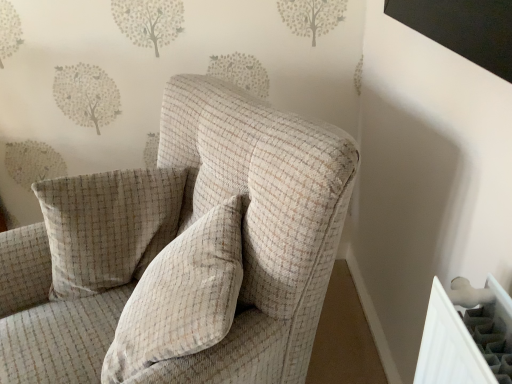
Question: Is beige checkered pillow at center, the second pillow from the front, taller than beige checkered pillow at center, the second pillow when ordered from back to front?

Choices:
 (A) no
 (B) yes

Answer: (B)

Question: Does beige checkered pillow at center, the second pillow from the front, have a greater width compared to beige checkered pillow at center, the 1th pillow positioned from the front?

Choices:
 (A) yes
 (B) no

Answer: (B)

Question: Considering the relative sizes of beige checkered pillow at center, the second pillow from the front, and beige checkered pillow at center, the second pillow when ordered from back to front, in the image provided, is beige checkered pillow at center, the second pillow from the front, bigger than beige checkered pillow at center, the second pillow when ordered from back to front,?

Choices:
 (A) no
 (B) yes

Answer: (A)

Question: Considering the relative sizes of beige checkered pillow at center, which ranks as the 1th pillow in back-to-front order, and beige checkered pillow at center, the 1th pillow positioned from the front, in the image provided, is beige checkered pillow at center, which ranks as the 1th pillow in back-to-front order, thinner than beige checkered pillow at center, the 1th pillow positioned from the front,?

Choices:
 (A) yes
 (B) no

Answer: (A)

Question: Is beige checkered pillow at center, which ranks as the 1th pillow in back-to-front order, positioned in front of beige checkered pillow at center, the second pillow when ordered from back to front?

Choices:
 (A) no
 (B) yes

Answer: (A)

Question: Is point (212, 296) closer or farther from the camera than point (321, 279)?

Choices:
 (A) closer
 (B) farther

Answer: (A)

Question: From a real-world perspective, is beige checkered pillow at center, the 1th pillow positioned from the front, positioned above or below beige checkered armchair at center?

Choices:
 (A) below
 (B) above

Answer: (B)

Question: From the image's perspective, is beige checkered pillow at center, the second pillow when ordered from back to front, above or below beige checkered armchair at center?

Choices:
 (A) above
 (B) below

Answer: (A)

Question: Which is correct: beige checkered pillow at center, the second pillow when ordered from back to front, is inside beige checkered armchair at center, or outside of it?

Choices:
 (A) inside
 (B) outside

Answer: (A)

Question: Considering the positions of beige checkered pillow at center, which ranks as the 1th pillow in back-to-front order, and beige checkered armchair at center in the image, is beige checkered pillow at center, which ranks as the 1th pillow in back-to-front order, taller or shorter than beige checkered armchair at center?

Choices:
 (A) tall
 (B) short

Answer: (B)

Question: Looking at their shapes, would you say beige checkered pillow at center, the second pillow from the front, is wider or thinner than beige checkered armchair at center?

Choices:
 (A) wide
 (B) thin

Answer: (B)

Question: Is beige checkered pillow at center, the second pillow from the front, bigger or smaller than beige checkered armchair at center?

Choices:
 (A) small
 (B) big

Answer: (A)

Question: From the image's perspective, relative to beige checkered armchair at center, is beige checkered pillow at center, which ranks as the 1th pillow in back-to-front order, above or below?

Choices:
 (A) below
 (B) above

Answer: (B)

Question: In terms of size, does beige checkered pillow at center, the 1th pillow positioned from the front, appear bigger or smaller than beige checkered pillow at center, which ranks as the 1th pillow in back-to-front order?

Choices:
 (A) small
 (B) big

Answer: (B)

Question: From a real-world perspective, is beige checkered pillow at center, the second pillow when ordered from back to front, above or below beige checkered pillow at center, the second pillow from the front?

Choices:
 (A) above
 (B) below

Answer: (A)